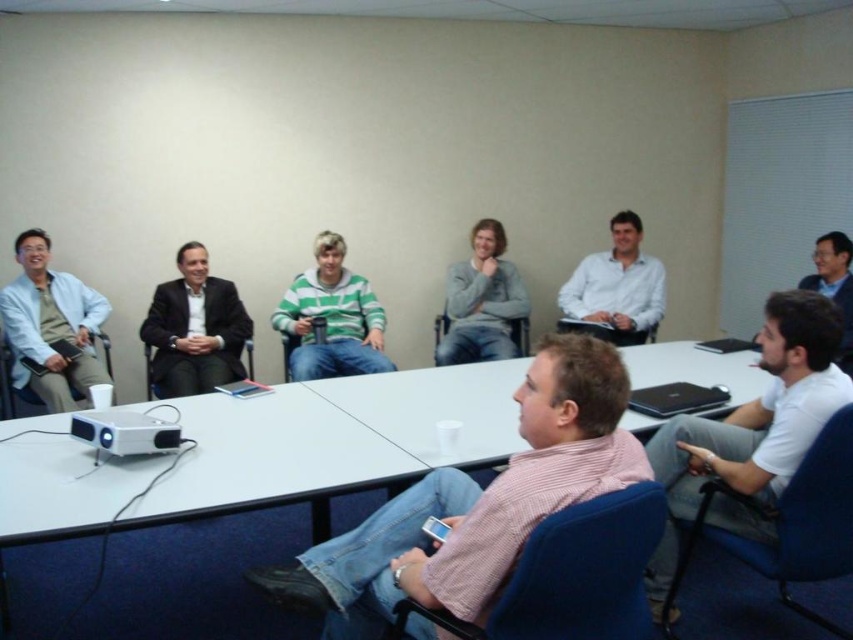
Is point (323, 269) closer to camera compared to point (581, 321)?

Yes, point (323, 269) is closer to viewer.

Is green striped sweater at center taller than white smooth shirt at center?

Correct, green striped sweater at center is much taller as white smooth shirt at center.

Between point (378, 337) and point (646, 307), which one is positioned behind?

Positioned behind is point (646, 307).

Locate an element on the screen. The width and height of the screenshot is (853, 640). green striped sweater at center is located at coordinates (331, 317).

Describe the element at coordinates (10, 384) in the screenshot. I see `matte black chair at left` at that location.

From the picture: Which is above, matte black chair at left or black fabric chair at center?

black fabric chair at center is higher up.

Locate an element on the screen. matte black chair at left is located at coordinates (10, 384).

Where is `matte black chair at left`? matte black chair at left is located at coordinates (10, 384).

Between green striped sweater at center and black fabric chair at center, which one is positioned higher?

green striped sweater at center

What do you see at coordinates (331, 317) in the screenshot?
I see `green striped sweater at center` at bounding box center [331, 317].

I want to click on green striped sweater at center, so click(331, 317).